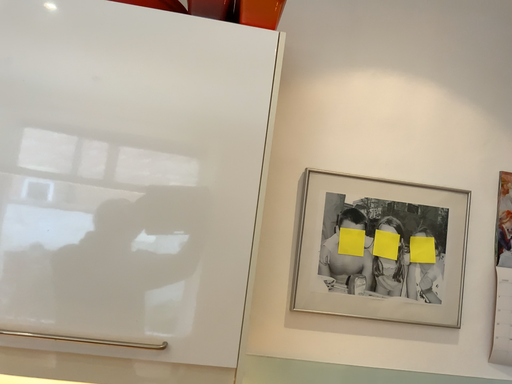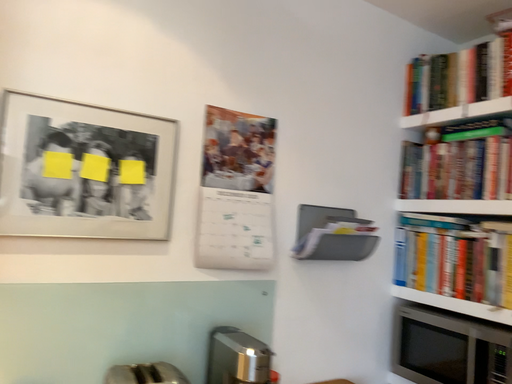
Question: How did the camera likely rotate when shooting the video?

Choices:
 (A) rotated right
 (B) rotated left

Answer: (A)